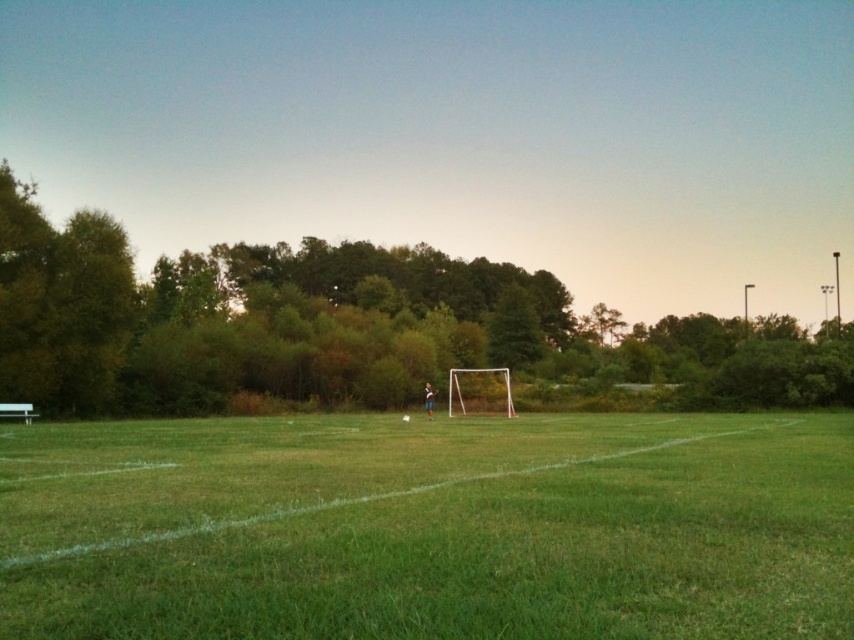
You are a soccer player standing on the field and you want to kick the ball towards the goal. Which object should you avoid hitting with your foot, the green leafy tree at center or the white plastic goal at center?

You should avoid hitting the white plastic goal at center with your foot because the green leafy tree at center is positioned on the right side of it, meaning the tree is not directly in the path to the goal.

Based on the scene description, where is the green grass at center located in terms of coordinates?

The green grass at center is located at point coordinates of (430, 528).